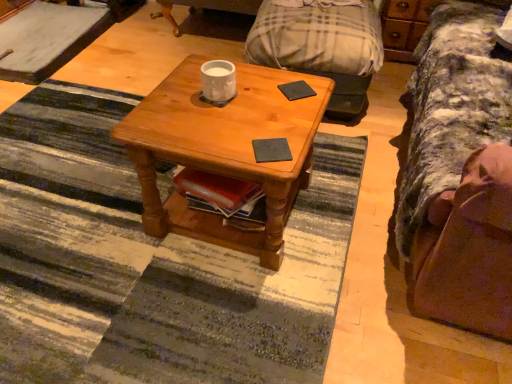
Locate an element on the screen. vacant space that is in between white glossy mug at center and black matte pad at center, the second pad from the bottom is located at coordinates pos(259,93).